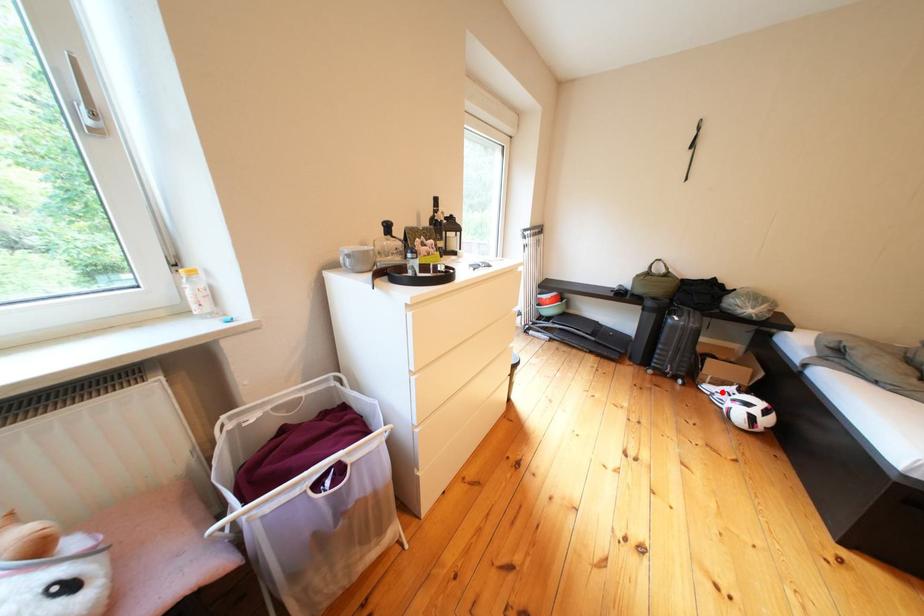
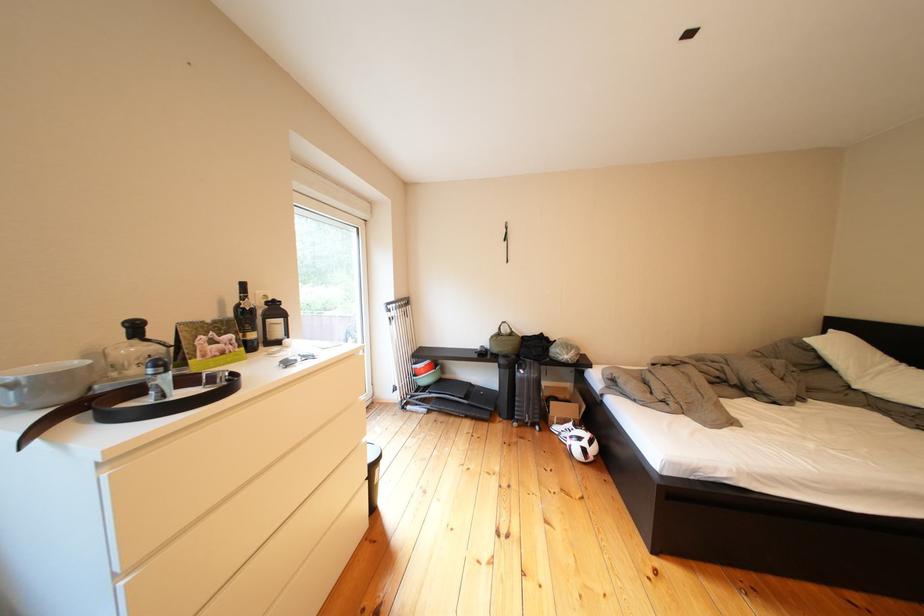
Find the pixel in the second image that matches the highlighted location in the first image.

(570, 432)